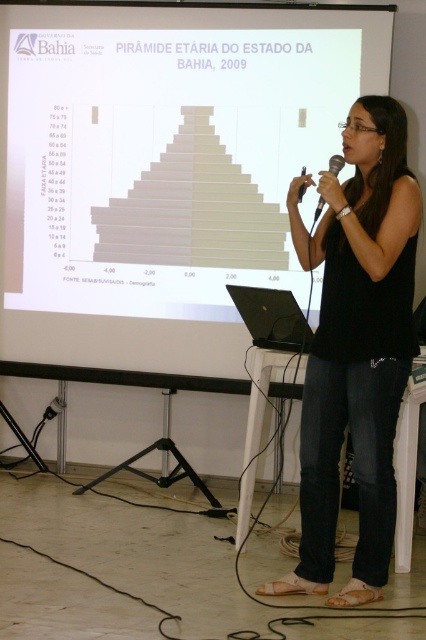
Question: Does white paper at upper center appear under black plastic microphone at center?

Choices:
 (A) no
 (B) yes

Answer: (A)

Question: Which point appears farthest from the camera in this image?

Choices:
 (A) (333, 156)
 (B) (362, 22)

Answer: (B)

Question: Which object is closer to the camera taking this photo?

Choices:
 (A) white paper at upper center
 (B) black plastic microphone at center

Answer: (B)

Question: Is white paper at upper center smaller than black cotton shirt at center?

Choices:
 (A) no
 (B) yes

Answer: (A)

Question: Which of the following is the closest to the observer?

Choices:
 (A) white paper at upper center
 (B) black plastic microphone at center

Answer: (B)

Question: Can you confirm if white paper at upper center is positioned to the right of black plastic microphone at center?

Choices:
 (A) yes
 (B) no

Answer: (B)